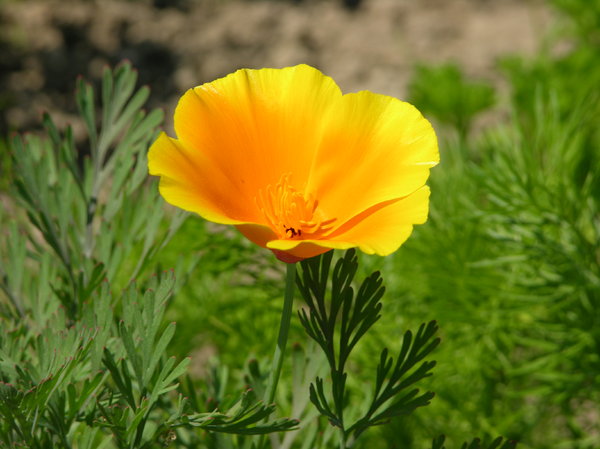
What are the coordinates of `empty space right of flower` in the screenshot? It's located at (521, 310).